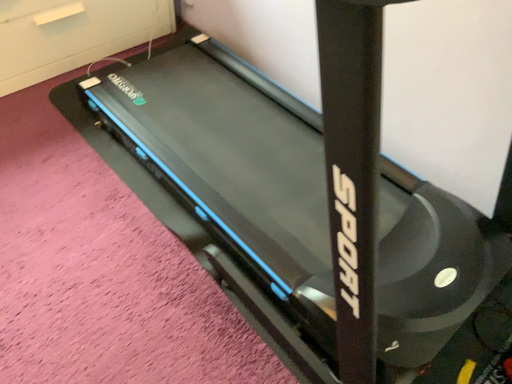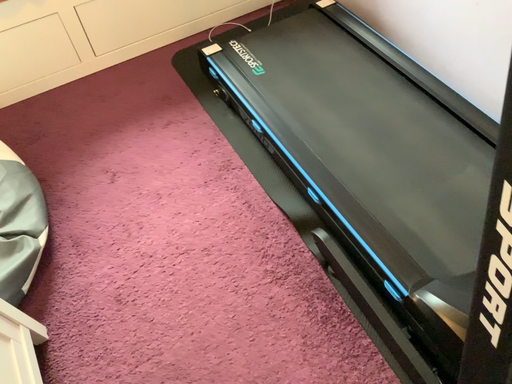
Question: Which way did the camera rotate in the video?

Choices:
 (A) rotated right
 (B) rotated left

Answer: (B)